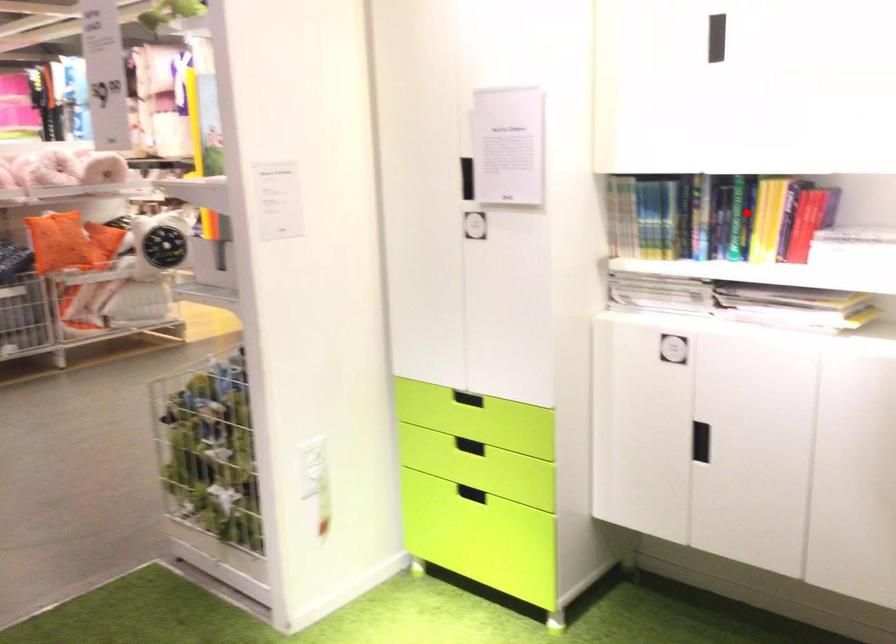
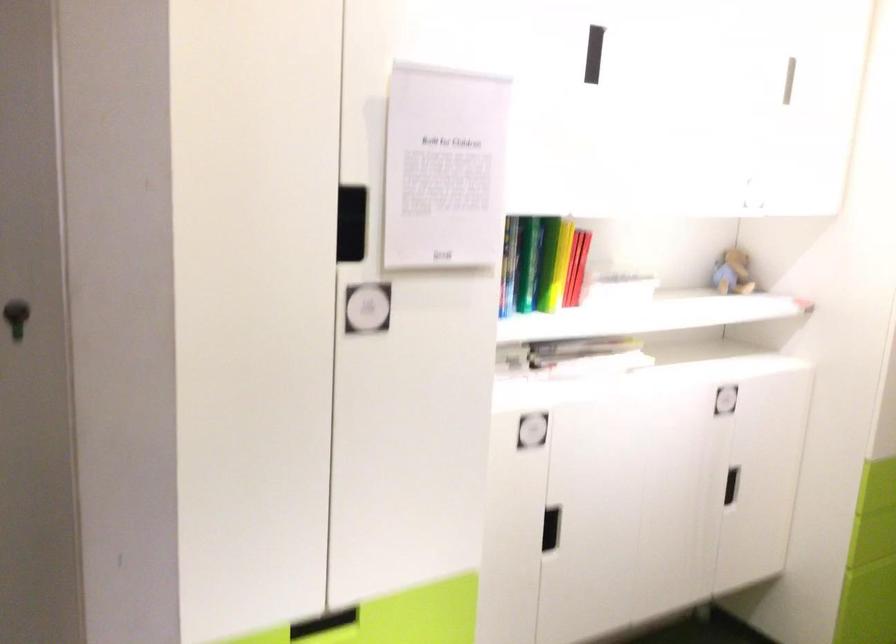
In the second image, find the point that corresponds to the highlighted location in the first image.

(528, 263)